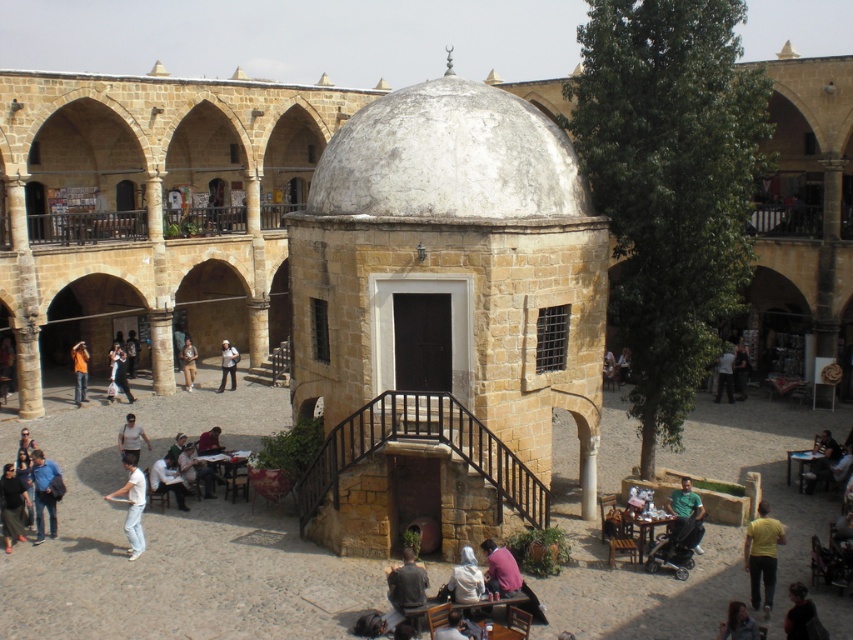
Question: Does green matte shirt at lower right have a larger size compared to orange t-shirt at lower left?

Choices:
 (A) yes
 (B) no

Answer: (B)

Question: Among these points, which one is farthest from the camera?

Choices:
 (A) [x=126, y=522]
 (B) [x=225, y=353]

Answer: (B)

Question: Which of the following is the farthest from the observer?

Choices:
 (A) (819, 442)
 (B) (238, 356)
 (C) (688, 477)

Answer: (B)

Question: Does dark blue jeans at lower left lie behind white fabric shirt at center?

Choices:
 (A) yes
 (B) no

Answer: (B)

Question: Which point is closer to the camera taking this photo?

Choices:
 (A) (474, 634)
 (B) (132, 460)
 (C) (486, 541)
 (D) (463, 548)

Answer: (A)

Question: Is white fabric jacket at lower center thinner than light brown leather jacket at lower left?

Choices:
 (A) no
 (B) yes

Answer: (B)